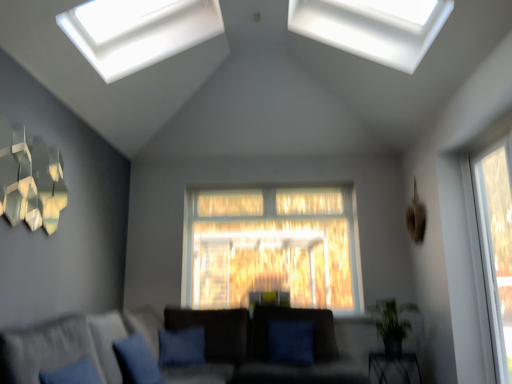
Locate an element on the screen. blue fabric pillow at center is located at coordinates (295, 319).

How much space does transparent glass window at upper center, the 2th window in the bottom-to-top sequence, occupy horizontally?

transparent glass window at upper center, the 2th window in the bottom-to-top sequence, is 83.63 centimeters in width.

Where is `transparent glass window at upper center, which appears as the 2th window when viewed from the top`? transparent glass window at upper center, which appears as the 2th window when viewed from the top is located at coordinates (138, 31).

Describe the element at coordinates (496, 245) in the screenshot. I see `transparent glass window at right, the first window viewed from the right` at that location.

Where is `dark gray fabric couch at lower left`? The image size is (512, 384). dark gray fabric couch at lower left is located at coordinates (257, 349).

Measure the distance between dark gray fabric couch at lower left and camera.

The distance of dark gray fabric couch at lower left from camera is 3.12 meters.

What is the approximate height of metallic geometric art at upper left?

It is 61.28 centimeters.

You are a GUI agent. You are given a task and a screenshot of the screen. Output one action in this format:
    pyautogui.click(x=<x>, y=<y>)
    Task: Click on the metallic geometric art at upper left
    Image resolution: width=512 pixels, height=384 pixels.
    Given the screenshot: What is the action you would take?
    (30, 179)

This screenshot has width=512, height=384. Describe the element at coordinates (393, 365) in the screenshot. I see `metallic black table at lower right` at that location.

Where is `transparent glass window at upper center, the third window in the bottom-to-top sequence`? Image resolution: width=512 pixels, height=384 pixels. transparent glass window at upper center, the third window in the bottom-to-top sequence is located at coordinates (373, 27).

In the scene shown: From the image's perspective, between transparent glass window at upper center, the third window in the bottom-to-top sequence, and metallic black table at lower right, which one is located above?

transparent glass window at upper center, the third window in the bottom-to-top sequence.

Looking at this image, is transparent glass window at upper center, which is counted as the second window, starting from the left, beside metallic black table at lower right?

No, transparent glass window at upper center, which is counted as the second window, starting from the left, is not in contact with metallic black table at lower right.

Considering the points (361, 44) and (379, 374), which point is behind, point (361, 44) or point (379, 374)?

Positioned behind is point (379, 374).

Who is shorter, transparent glass window at upper center, the third window in the bottom-to-top sequence, or metallic black table at lower right?

With less height is metallic black table at lower right.

Which is behind, transparent glass window at right, the first window viewed from the right, or dark gray fabric couch at lower left?

Positioned behind is transparent glass window at right, the first window viewed from the right.

From the image's perspective, between transparent glass window at right, the 1th window from the bottom, and dark gray fabric couch at lower left, which one is located above?

transparent glass window at right, the 1th window from the bottom, from the image's perspective.

Looking at their sizes, would you say transparent glass window at right, the first window viewed from the right, is wider or thinner than dark gray fabric couch at lower left?

In the image, transparent glass window at right, the first window viewed from the right, appears to be more narrow than dark gray fabric couch at lower left.

Does dark gray fabric couch at lower left appear on the right side of metallic black table at lower right?

Incorrect, dark gray fabric couch at lower left is not on the right side of metallic black table at lower right.

Looking at the image, does dark gray fabric couch at lower left seem bigger or smaller compared to metallic black table at lower right?

Considering their sizes, dark gray fabric couch at lower left takes up more space than metallic black table at lower right.

Which object is further away from the camera, dark gray fabric couch at lower left or metallic black table at lower right?

metallic black table at lower right is further away from the camera.

Between point (260, 364) and point (387, 381), which one is positioned behind?

The point (260, 364) is more distant.

From the image's perspective, is transparent glass window at right, the first window viewed from the right, located above or below metallic geometric art at upper left?

transparent glass window at right, the first window viewed from the right, is situated lower than metallic geometric art at upper left in the image.

Is transparent glass window at right, the first window viewed from the right, at the left side of metallic geometric art at upper left?

No.

Measure the distance between transparent glass window at right, arranged as the third window when viewed from the top, and metallic geometric art at upper left.

transparent glass window at right, arranged as the third window when viewed from the top, is 3.34 meters from metallic geometric art at upper left.

Is transparent glass window at right, the 1th window from the bottom, closer to the viewer compared to metallic geometric art at upper left?

No.

Is metallic geometric art at upper left facing away from transparent glass window at upper center, the 2th window in the bottom-to-top sequence?

No, metallic geometric art at upper left's orientation is not away from transparent glass window at upper center, the 2th window in the bottom-to-top sequence.

Locate an element on the screen. The height and width of the screenshot is (384, 512). lamp below the transparent glass window at upper center, arranged as the 1th window when viewed from the left (from a real-world perspective) is located at coordinates (30, 179).

How different are the orientations of metallic geometric art at upper left and transparent glass window at upper center, arranged as the 1th window when viewed from the left, in degrees?

There is a 0.784-degree angle between the facing directions of metallic geometric art at upper left and transparent glass window at upper center, arranged as the 1th window when viewed from the left.

From the image's perspective, is metallic geometric art at upper left on top of transparent glass window at upper center, arranged as the 1th window when viewed from the left?

No, from the image's perspective, metallic geometric art at upper left is not over transparent glass window at upper center, arranged as the 1th window when viewed from the left.

Based on the photo, can you confirm if metallic geometric art at upper left is bigger than blue fabric pillow at lower center?

No.

From the image's perspective, which one is positioned lower, metallic geometric art at upper left or blue fabric pillow at lower center?

blue fabric pillow at lower center.

Is metallic geometric art at upper left turned away from blue fabric pillow at lower center?

No, metallic geometric art at upper left is not facing away from blue fabric pillow at lower center.

From a real-world perspective, which object rests below the other?

blue fabric pillow at lower center, from a real-world perspective.

Is metallic black table at lower right positioned with its back to green leafy plant at lower right?

→ metallic black table at lower right does not have its back to green leafy plant at lower right.

Considering the relative sizes of metallic black table at lower right and green leafy plant at lower right in the image provided, is metallic black table at lower right wider than green leafy plant at lower right?

Indeed, metallic black table at lower right has a greater width compared to green leafy plant at lower right.

Consider the image. Considering the sizes of metallic black table at lower right and green leafy plant at lower right in the image, is metallic black table at lower right bigger or smaller than green leafy plant at lower right?

Considering their sizes, metallic black table at lower right takes up less space than green leafy plant at lower right.

Between metallic black table at lower right and green leafy plant at lower right, which one appears on the right side from the viewer's perspective?

Positioned to the right is metallic black table at lower right.

This screenshot has width=512, height=384. Identify the location of the 3rd window above the metallic black table at lower right (from the image's perspective). (x=373, y=27).

Locate an element on the screen. The width and height of the screenshot is (512, 384). the 1st window behind the dark gray fabric couch at lower left, starting your count from the anchor is located at coordinates (496, 245).

From the image, which object appears to be farther from metallic black table at lower right, transparent glass window at right, arranged as the third window when viewed from the top, or blue fabric pillow at lower center?

blue fabric pillow at lower center is further to metallic black table at lower right.

Looking at this image, considering their positions, is dark gray fabric couch at lower left positioned further to metallic black table at lower right than transparent glass window at upper center, the third window in the bottom-to-top sequence?

Among the two, transparent glass window at upper center, the third window in the bottom-to-top sequence, is located further to metallic black table at lower right.

When comparing their distances from blue fabric pillow at center, does transparent glass window at upper center, which is counted as the second window, starting from the left, or dark gray fabric couch at lower left seem closer?

Based on the image, dark gray fabric couch at lower left appears to be nearer to blue fabric pillow at center.

Looking at the image, which one is located further to transparent glass window at upper center, the third window in the bottom-to-top sequence, metallic black table at lower right or green leafy plant at lower right?

Among the two, metallic black table at lower right is located further to transparent glass window at upper center, the third window in the bottom-to-top sequence.

Considering their positions, is blue fabric pillow at lower center positioned further to blue fabric pillow at center than transparent glass window at upper center, the third window in the bottom-to-top sequence?

Based on the image, transparent glass window at upper center, the third window in the bottom-to-top sequence, appears to be further to blue fabric pillow at center.

Based on their spatial positions, is metallic geometric art at upper left or dark gray fabric couch at lower left further from transparent glass window at upper center, the 2th window in the bottom-to-top sequence?

Among the two, dark gray fabric couch at lower left is located further to transparent glass window at upper center, the 2th window in the bottom-to-top sequence.

From the image, which object appears to be farther from metallic geometric art at upper left, transparent glass window at upper center, arranged as the 1th window when viewed from the left, or green leafy plant at lower right?

green leafy plant at lower right is further to metallic geometric art at upper left.

Based on their spatial positions, is dark gray fabric couch at lower left or green leafy plant at lower right closer to blue fabric pillow at center?

Among the two, dark gray fabric couch at lower left is located nearer to blue fabric pillow at center.

Image resolution: width=512 pixels, height=384 pixels. I want to click on plant between transparent glass window at upper center, the 2th window in the bottom-to-top sequence, and transparent glass window at right, the 1th window from the bottom, in the horizontal direction, so click(x=392, y=324).

What are the coordinates of `lamp that lies between transparent glass window at upper center, marked as the second window in a right-to-left arrangement, and blue fabric pillow at center from top to bottom` in the screenshot? It's located at (30, 179).

This screenshot has height=384, width=512. What are the coordinates of `sit located between metallic geometric art at upper left and transparent glass window at right, arranged as the third window when viewed from the top, in the left-right direction` in the screenshot? It's located at (295, 319).

In order to click on table between metallic geometric art at upper left and transparent glass window at right, arranged as the third window when viewed from the top in this screenshot , I will do `click(393, 365)`.